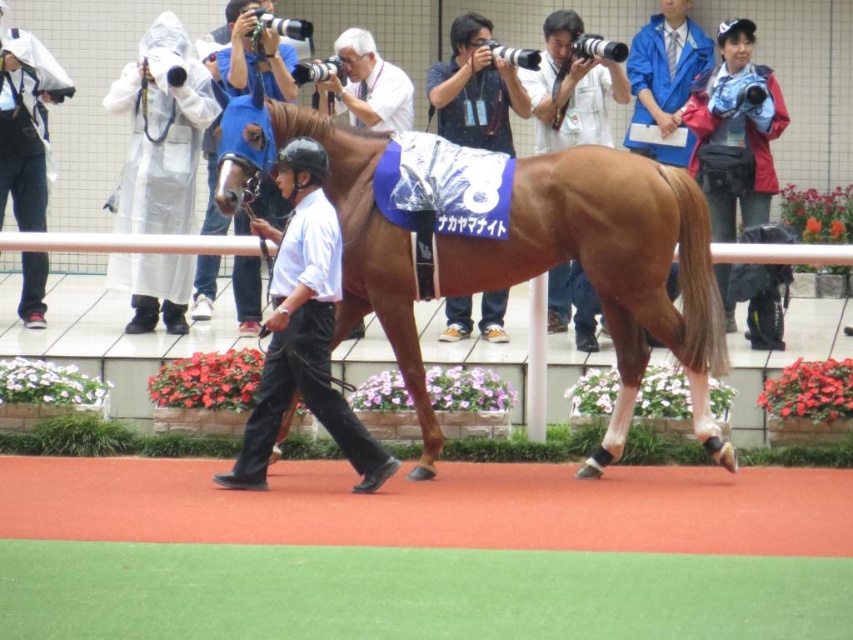
You are a photographer at the horse racing event. You notice the matte white shirt at center and the blue fabric helmet at center. Which object is positioned lower in the image?

The matte white shirt at center is located below the blue fabric helmet at center, so the matte white shirt at center is positioned lower in the image.

You are a photographer at the event and need to capture a closeup of the blue fabric helmet at center and the blue fabric at upper right. Since your camera has a limited field of view, you can only focus on one object at a time. Which object should you choose to ensure you can fit the entire object into the frame?

The blue fabric helmet at center has a smaller width compared to the blue fabric at upper right. Therefore, to ensure the entire object fits into the frame, you should choose the blue fabric helmet at center first since it is narrower and requires less space in the camera view.

You are a photographer at the event and need to decide where to focus your camera. Which object, the matte white shirt at center or the blue fabric at upper right, takes up more visual space in the image?

The blue fabric at upper right takes up more visual space than the matte white shirt at center because the matte white shirt at center occupies less space than blue fabric at upper right.